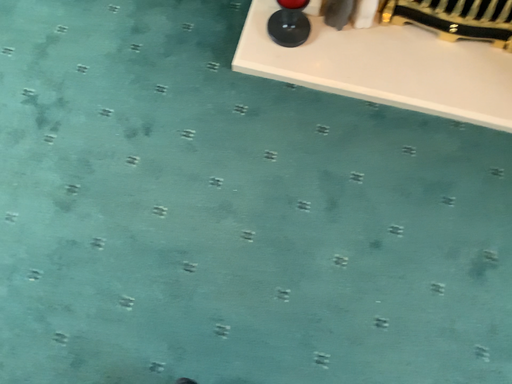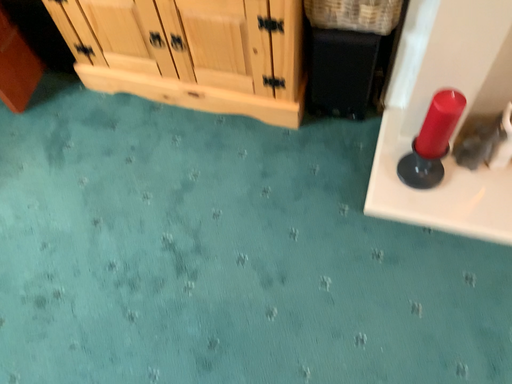
Question: Which way did the camera rotate in the video?

Choices:
 (A) rotated upward
 (B) rotated downward

Answer: (A)